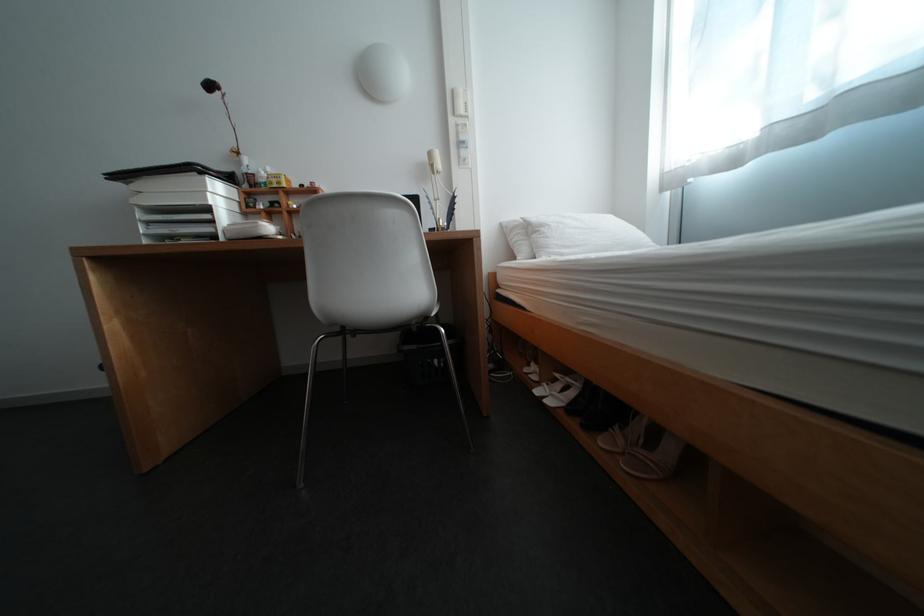
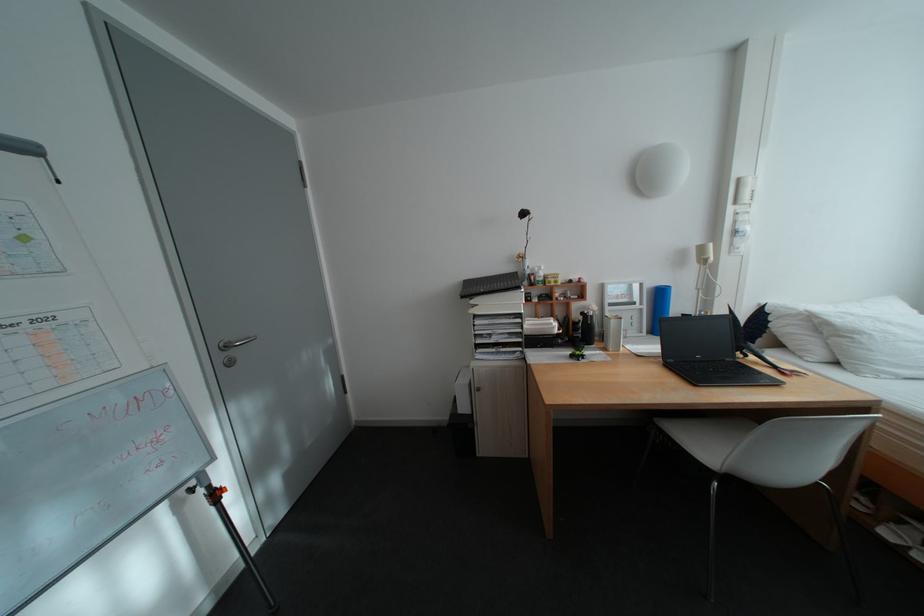
Where in the second image is the point corresponding to the point at 555,228 from the first image?

(871, 334)